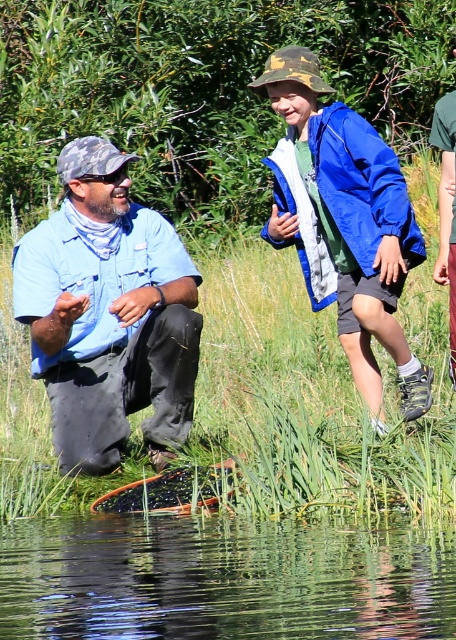
Question: Does blue denim shirt at left appear under blue fabric jacket at upper center?

Choices:
 (A) no
 (B) yes

Answer: (B)

Question: Is clear water at lower left below blue denim shirt at left?

Choices:
 (A) no
 (B) yes

Answer: (B)

Question: Among these points, which one is farthest from the camera?

Choices:
 (A) (31, 545)
 (B) (65, 371)

Answer: (B)

Question: Is clear water at lower left smaller than blue denim shirt at left?

Choices:
 (A) no
 (B) yes

Answer: (B)

Question: Based on their relative distances, which object is farther from the blue matte jacket at upper center?

Choices:
 (A) blue fabric jacket at upper center
 (B) blue denim shirt at left
 (C) clear water at lower left

Answer: (C)

Question: Which of the following is the farthest from the observer?

Choices:
 (A) (428, 595)
 (B) (444, 170)

Answer: (B)